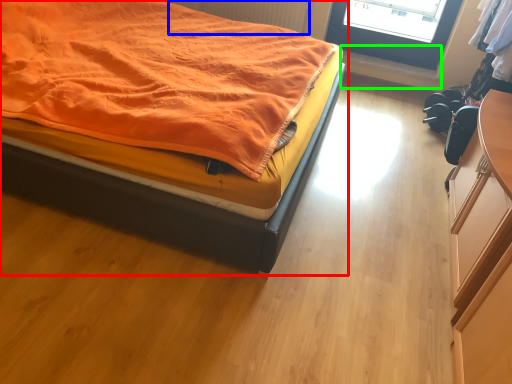
Question: Considering the real-world distances, which object is farthest from bed (highlighted by a red box)? radiator (highlighted by a blue box) or window sill (highlighted by a green box)?

Choices:
 (A) radiator
 (B) window sill

Answer: (B)